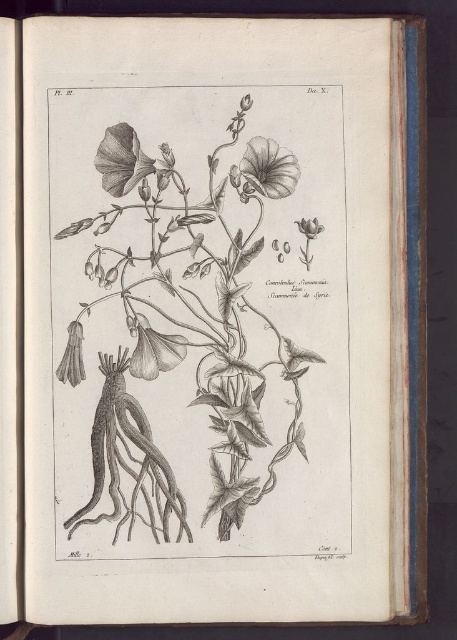
Who is lower down, gray pencil sketch plant at center or grayish-white textured flower at lower left?

grayish-white textured flower at lower left is below.

Which of these two, gray pencil sketch plant at center or grayish-white textured flower at lower left, stands taller?

gray pencil sketch plant at center is taller.

I want to click on gray pencil sketch plant at center, so click(184, 353).

Does point (106, 132) come closer to viewer compared to point (70, 372)?

Yes.

Is smooth gray petal at upper center above grayish-white textured flower at lower left?

Correct, smooth gray petal at upper center is located above grayish-white textured flower at lower left.

Which is behind, point (104, 186) or point (65, 344)?

The point (104, 186) is more distant.

Image resolution: width=457 pixels, height=640 pixels. What are the coordinates of `smooth gray petal at upper center` in the screenshot? It's located at (122, 160).

In the scene shown: Can you confirm if smooth paper-like petal at upper center is thinner than grayish-white textured flower at lower left?

No, smooth paper-like petal at upper center is not thinner than grayish-white textured flower at lower left.

Does smooth paper-like petal at upper center come behind grayish-white textured flower at lower left?

No, it is in front of grayish-white textured flower at lower left.

The width and height of the screenshot is (457, 640). What do you see at coordinates (269, 168) in the screenshot?
I see `smooth paper-like petal at upper center` at bounding box center [269, 168].

The height and width of the screenshot is (640, 457). What are the coordinates of `smooth paper-like petal at upper center` in the screenshot? It's located at (269, 168).